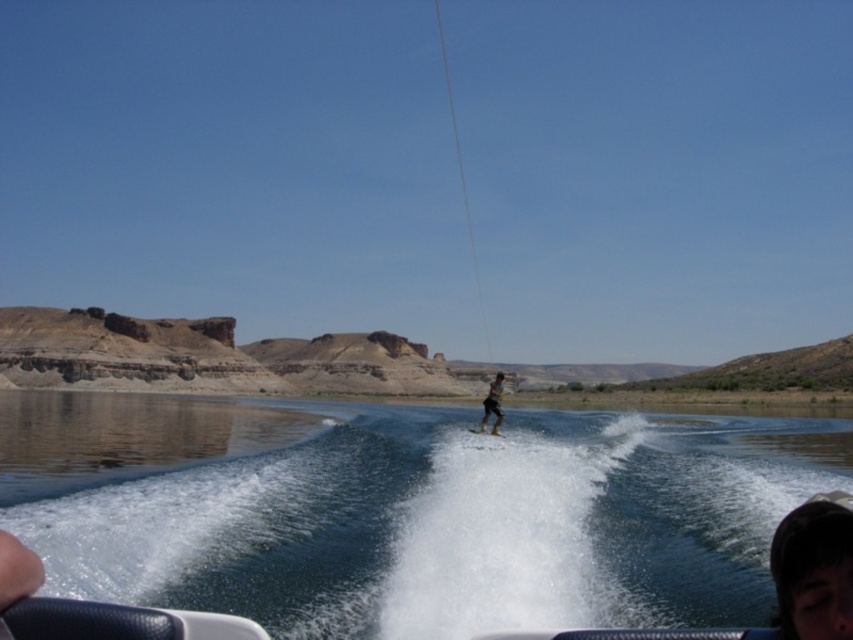
From the picture: You are a photographer trying to capture the water ski in the image. Since you want to focus on the water ski, which object should you adjust your camera to zoom in on more, the clear blue water at center or the white matte water ski at center?

You should zoom in on the white matte water ski at center because it is smaller in size compared to the clear blue water at center, as stated in the description.

You are a photographer trying to capture the water ski in the scene. Based on their positions, which object is closer to the camera between the clear blue water at center and the white matte water ski at center?

The clear blue water at center is closer to the camera because it is positioned in front of the white matte water ski at center.

You are a photographer standing on the boat, and you want to take a photo of the smooth skin face at lower right and the white matte water ski at center. The camera you have can focus on objects within 50 meters. Can you capture both subjects clearly in the same photo?

The smooth skin face at lower right is 58.89 meters from the white matte water ski at center, which exceeds the camera focus range of 50 meters. Therefore, both subjects cannot be in focus simultaneously in the same photo.